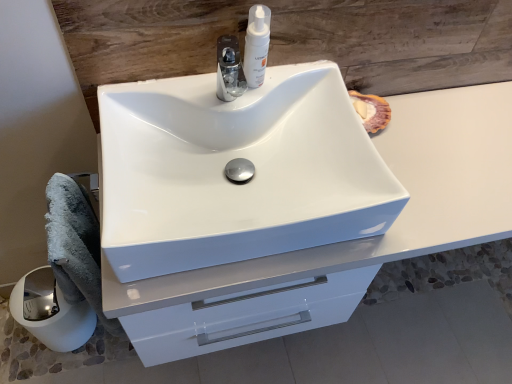
Question: Does point [87, 256] appear closer or farther from the camera than point [429, 243]?

Choices:
 (A) closer
 (B) farther

Answer: (B)

Question: From the image's perspective, relative to white glossy cabinet at center, is gray fluffy bath towel at lower left above or below?

Choices:
 (A) below
 (B) above

Answer: (A)

Question: Which object is positioned closest to the gray fluffy bath towel at lower left?

Choices:
 (A) white glossy paper towel at lower left
 (B) white glossy pump at upper center
 (C) white glossy sink at center
 (D) white glossy cabinet at center

Answer: (A)

Question: Which is nearer to the gray fluffy bath towel at lower left?

Choices:
 (A) white glossy cabinet at center
 (B) white glossy pump at upper center
 (C) white glossy paper towel at lower left
 (D) white glossy sink at center

Answer: (C)